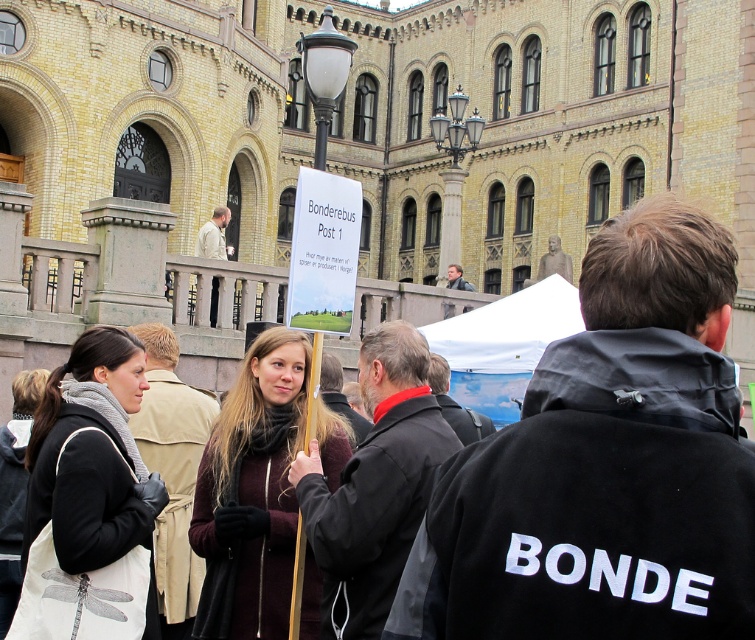
Who is positioned more to the right, black fabric bag at lower left or maroon woolen sweater at center?

Positioned to the right is maroon woolen sweater at center.

Measure the distance between black fabric bag at lower left and maroon woolen sweater at center.

A distance of 6.16 meters exists between black fabric bag at lower left and maroon woolen sweater at center.

Is point (48, 449) positioned behind point (233, 548)?

No, (48, 449) is closer to viewer.

You are a GUI agent. You are given a task and a screenshot of the screen. Output one action in this format:
    pyautogui.click(x=<x>, y=<y>)
    Task: Click on the black fabric bag at lower left
    The height and width of the screenshot is (640, 755).
    Given the screenshot: What is the action you would take?
    pyautogui.click(x=88, y=500)